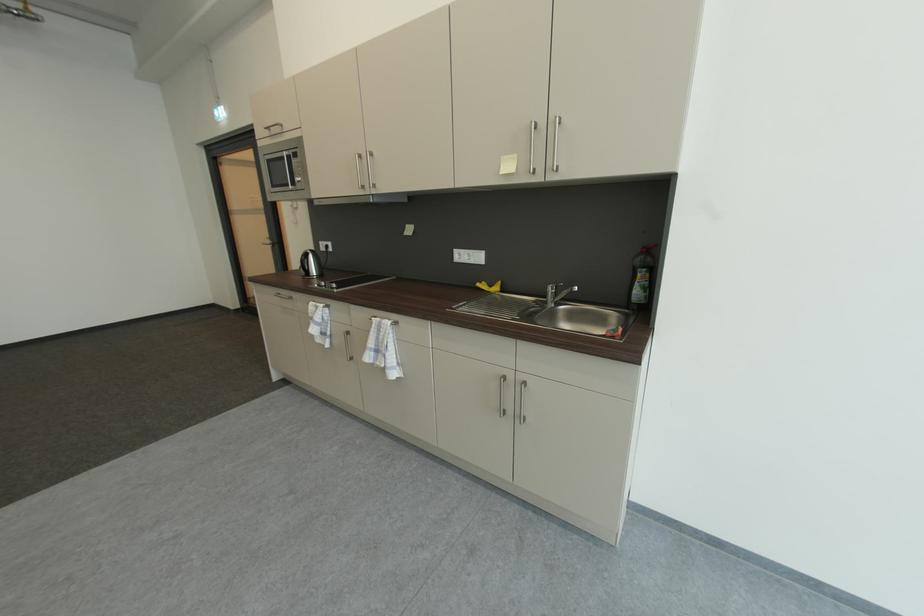
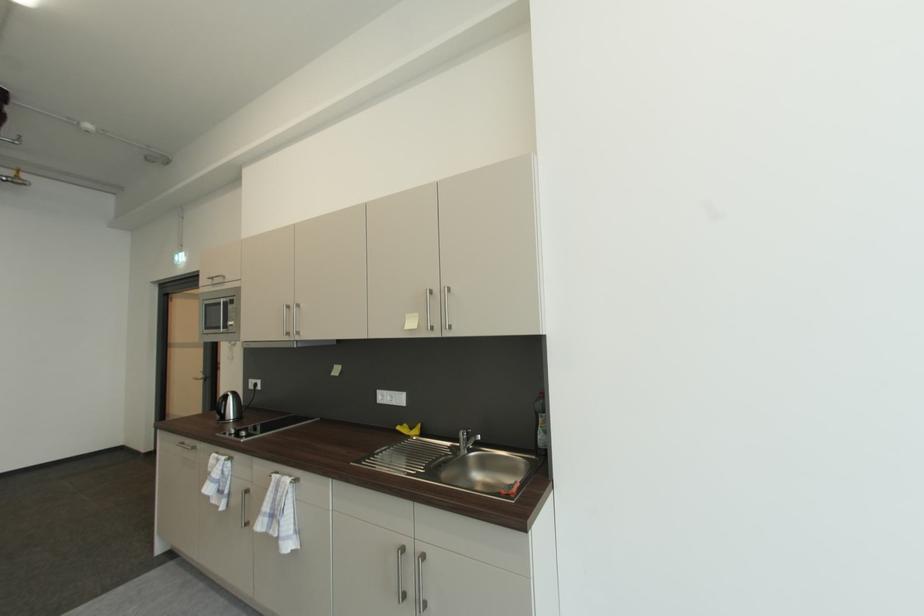
The point at (642, 286) is marked in the first image. Where is the corresponding point in the second image?

(545, 430)